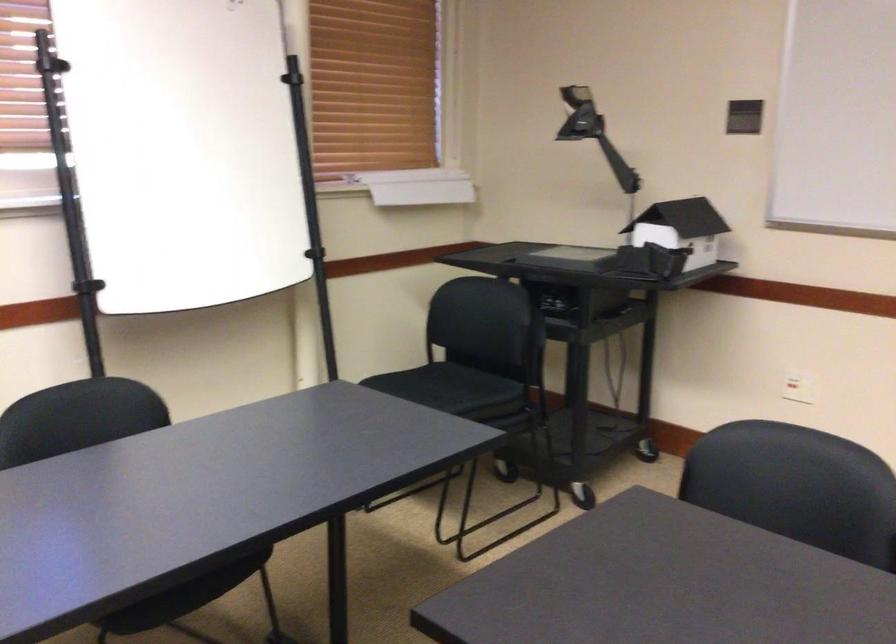
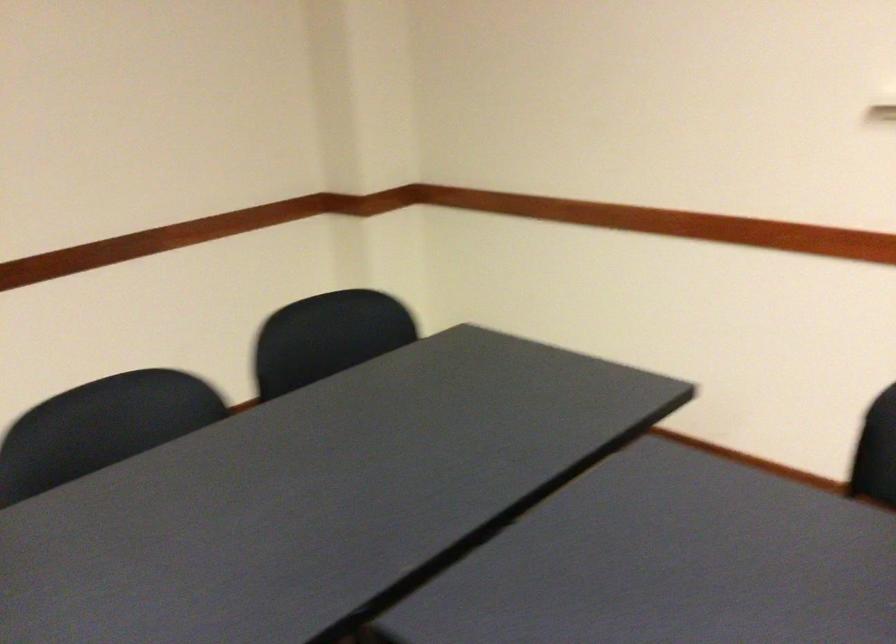
In the scene shown: The images are taken continuously from a first-person perspective. In which direction is your viewpoint rotating?

The camera rotated toward left-down.